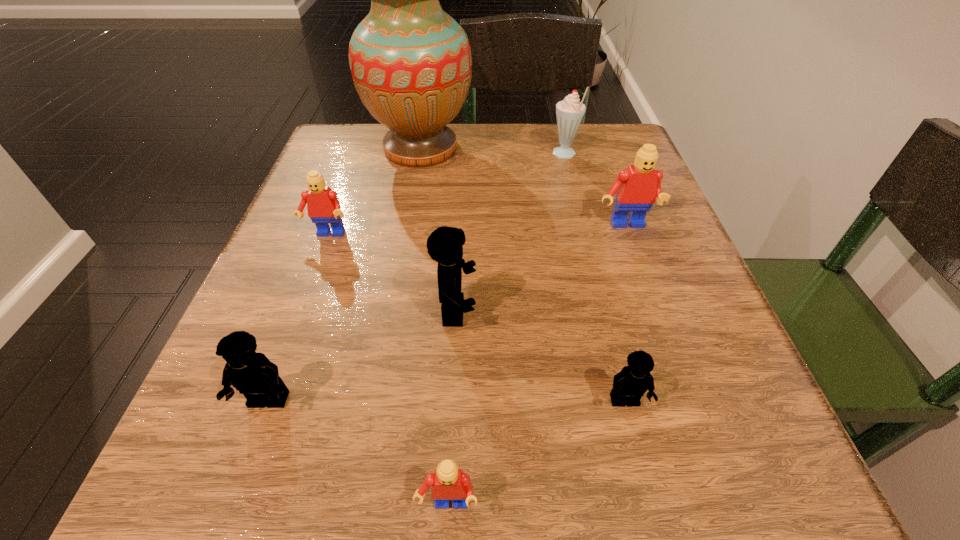
Locate an element on the screen. the tallest object is located at coordinates (411, 64).

Locate an element on the screen. white milkshake is located at coordinates (569, 112).

This screenshot has width=960, height=540. I want to click on the second yellow Lego from right to left, so click(x=445, y=244).

I want to click on the farthest yellow Lego, so click(x=445, y=244).

Image resolution: width=960 pixels, height=540 pixels. I want to click on the biggest red Lego, so click(636, 188).

This screenshot has width=960, height=540. I want to click on the second smallest red Lego, so click(323, 206).

You are a GUI agent. You are given a task and a screenshot of the screen. Output one action in this format:
    pyautogui.click(x=<x>, y=<y>)
    Task: Click on the second biggest yellow Lego
    The image size is (960, 540).
    Given the screenshot: What is the action you would take?
    pyautogui.click(x=252, y=374)

I want to click on the smallest yellow Lego, so click(x=630, y=384).

You are a GUI agent. You are given a task and a screenshot of the screen. Output one action in this format:
    pyautogui.click(x=<x>, y=<y>)
    Task: Click on the nearest object
    
    Given the screenshot: What is the action you would take?
    [x=448, y=482]

The height and width of the screenshot is (540, 960). Find the location of `the second red Lego from right to left`. the second red Lego from right to left is located at coordinates (448, 482).